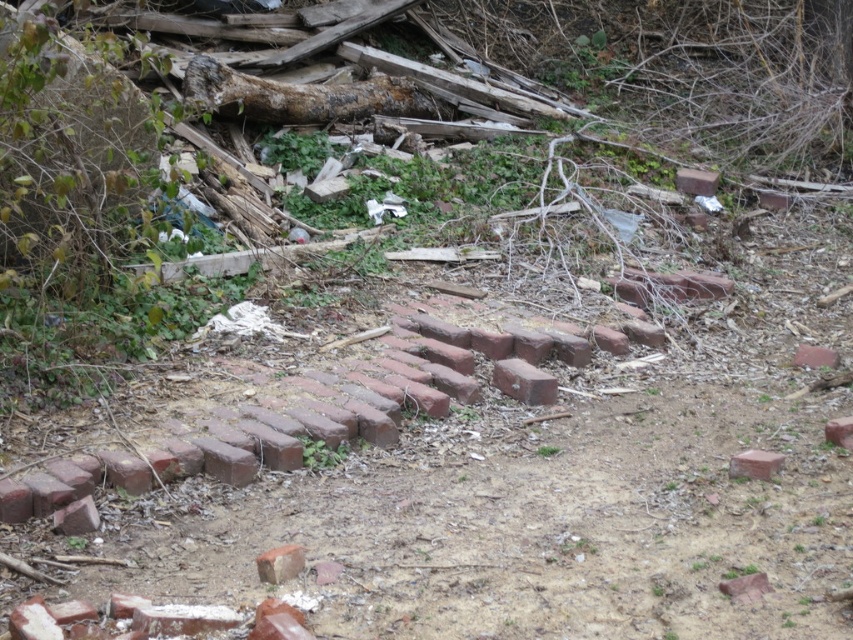
You are a construction worker trying to clear the debris. You see the red brick at center and the red matte brick at lower right. Which brick should you pick up first if you want to start with the one closer to you?

You should pick up the red brick at center first because it is in front of the red matte brick at lower right, meaning it is closer to you.

You are a construction worker assessing the debris. You need to identify which brick is shorter between the red matte brick at lower right and the red clay brick at center. Which one is it?

The red matte brick at lower right has a lesser height compared to the red clay brick at center, so the red matte brick at lower right is shorter.